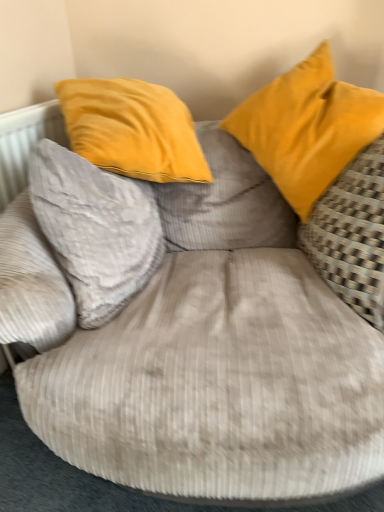
Question: Would you say yellow fabric pillow at right, the 1th pillow viewed from the right, is to the left or to the right of matte yellow pillow at upper right, acting as the 2th pillow starting from the left, in the picture?

Choices:
 (A) left
 (B) right

Answer: (B)

Question: Which is correct: yellow fabric pillow at right, which is the 3th pillow in left-to-right order, is inside matte yellow pillow at upper right, acting as the 2th pillow starting from the left, or outside of it?

Choices:
 (A) outside
 (B) inside

Answer: (A)

Question: Based on their relative distances, which object is farther from the gray corduroy pillow at left, which is the 3th pillow in right-to-left order?

Choices:
 (A) yellow fabric pillow at right, the 1th pillow viewed from the right
 (B) matte yellow pillow at upper right, which appears as the 2th pillow when viewed from the right

Answer: (A)

Question: Which object is positioned closest to the gray corduroy pillow at left, the 1th pillow in the left-to-right sequence?

Choices:
 (A) matte yellow pillow at upper right, which appears as the 2th pillow when viewed from the right
 (B) yellow fabric pillow at right, which is the 3th pillow in left-to-right order

Answer: (A)